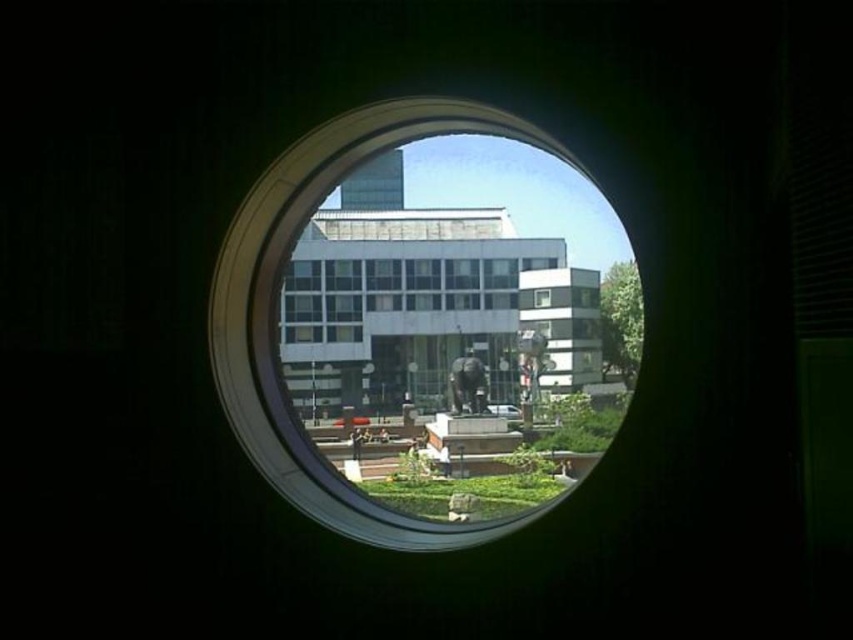
Does transparent glass porthole at center appear on the right side of white glass building at center?

Indeed, transparent glass porthole at center is positioned on the right side of white glass building at center.

Is transparent glass porthole at center bigger than white glass building at center?

Yes, transparent glass porthole at center is bigger than white glass building at center.

Is point (256, 428) closer to camera compared to point (335, 316)?

Yes, it is in front of point (335, 316).

This screenshot has height=640, width=853. I want to click on transparent glass porthole at center, so coord(274,282).